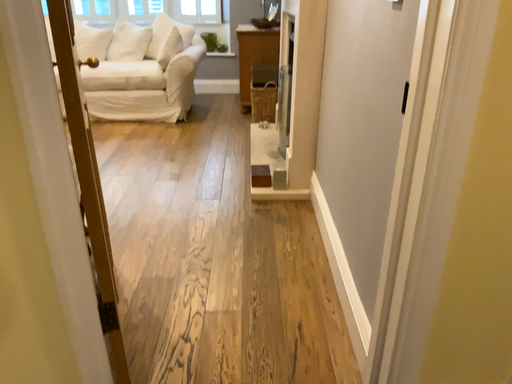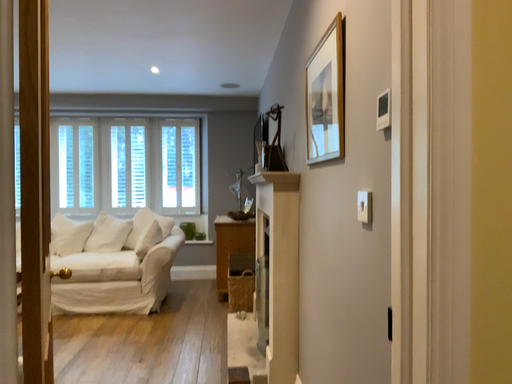
Question: Which way did the camera rotate in the video?

Choices:
 (A) rotated downward
 (B) rotated upward

Answer: (B)